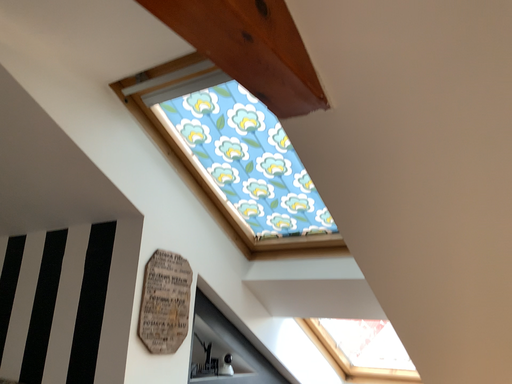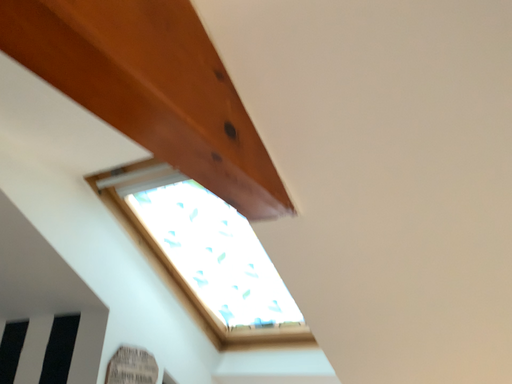
Question: How did the camera likely rotate when shooting the video?

Choices:
 (A) rotated upward
 (B) rotated downward

Answer: (A)